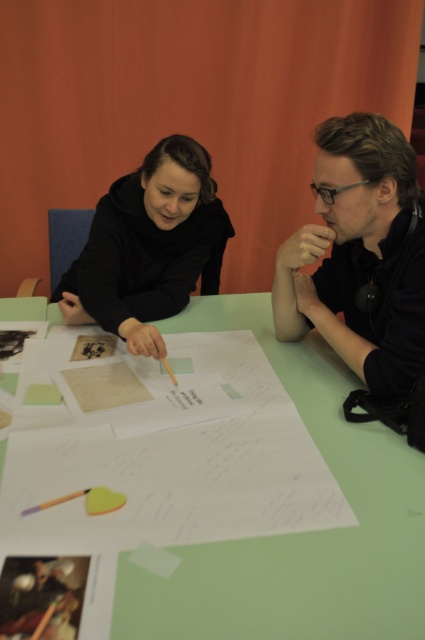
Question: Among these objects, which one is farthest from the camera?

Choices:
 (A) black matte hoodie at center
 (B) black matte paper at center
 (C) green paper at center

Answer: (A)

Question: Considering the real-world distances, which object is farthest from the black matte paper at center?

Choices:
 (A) black matte hoodie at center
 (B) black matte shirt at center
 (C) green paper at center

Answer: (A)

Question: Where is black matte shirt at center located in relation to black matte hoodie at center in the image?

Choices:
 (A) below
 (B) above

Answer: (A)

Question: Which point is farther from the camera taking this photo?

Choices:
 (A) (331, 145)
 (B) (370, 608)

Answer: (A)

Question: Can you confirm if black matte shirt at center is positioned to the left of black matte hoodie at center?

Choices:
 (A) no
 (B) yes

Answer: (A)

Question: Does green paper at center appear under black matte shirt at center?

Choices:
 (A) no
 (B) yes

Answer: (B)